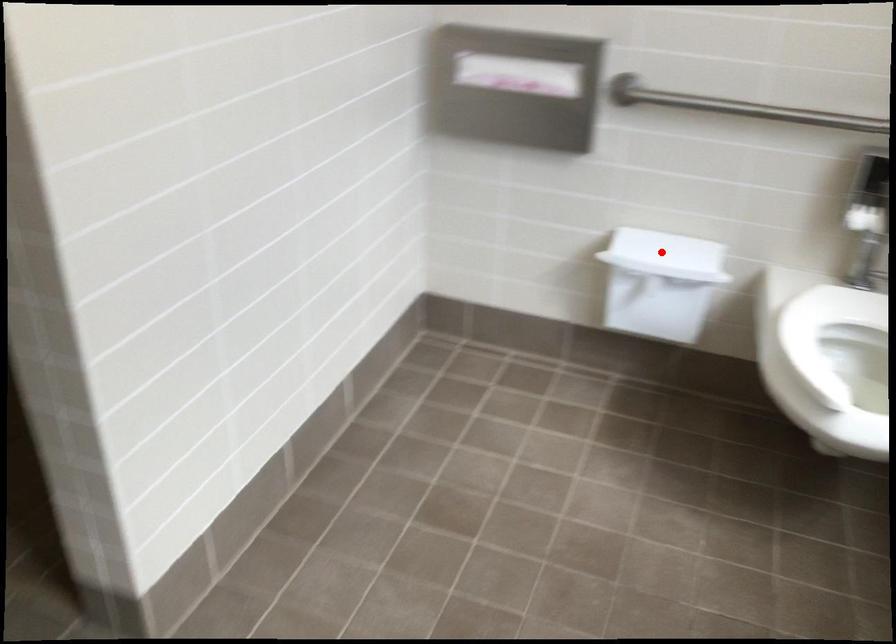
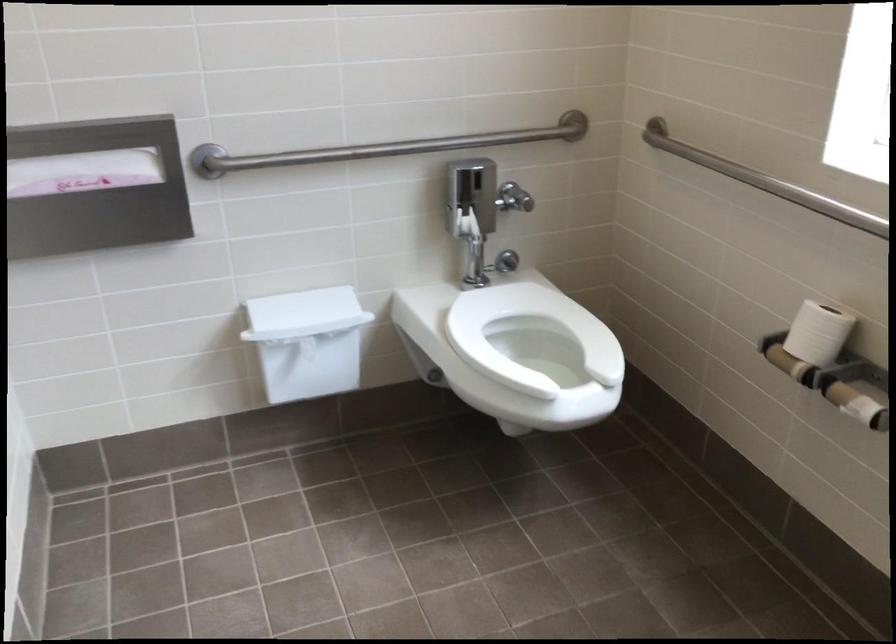
Locate, in the second image, the point that corresponds to the highlighted location in the first image.

(304, 314)